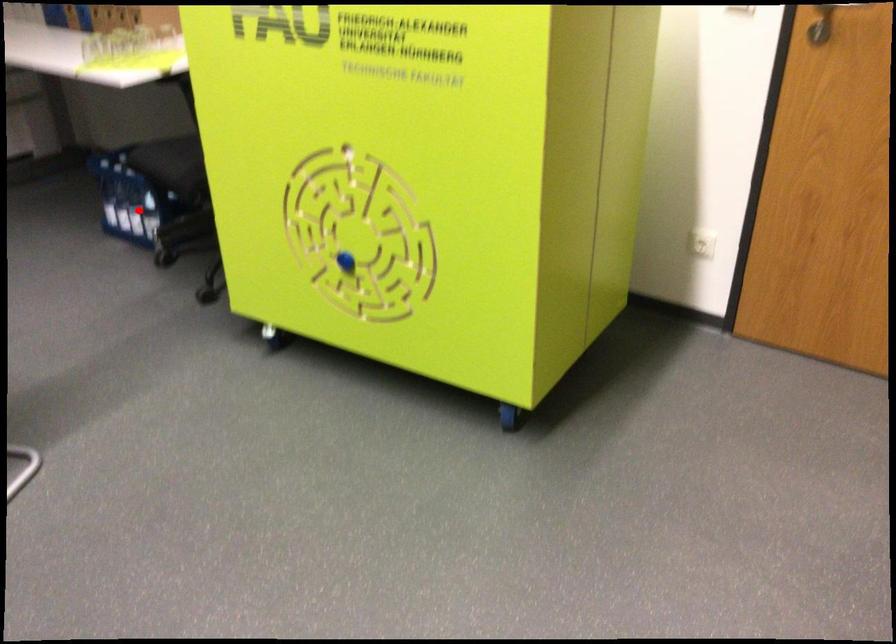
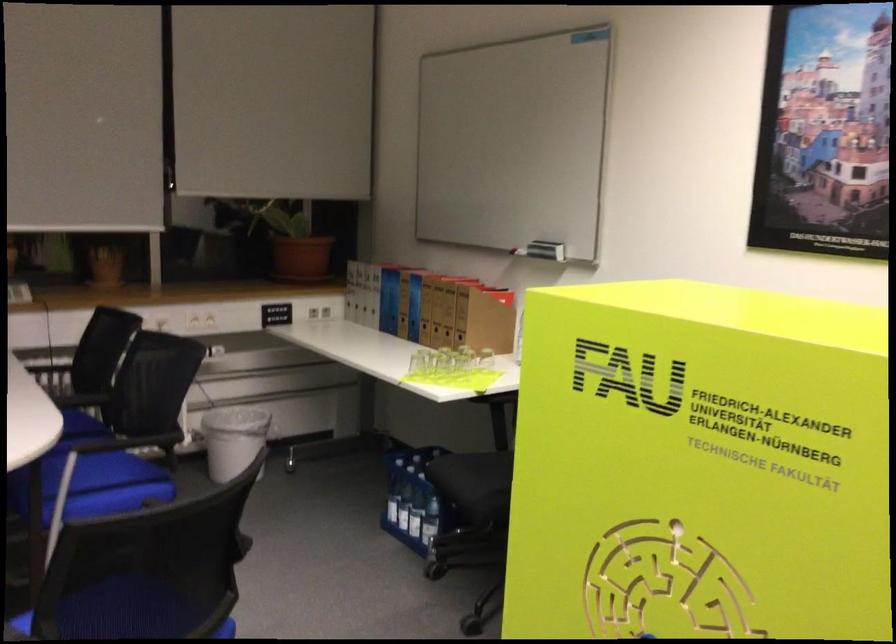
Where in the second image is the point corresponding to the highlighted location from the first image?

(416, 514)